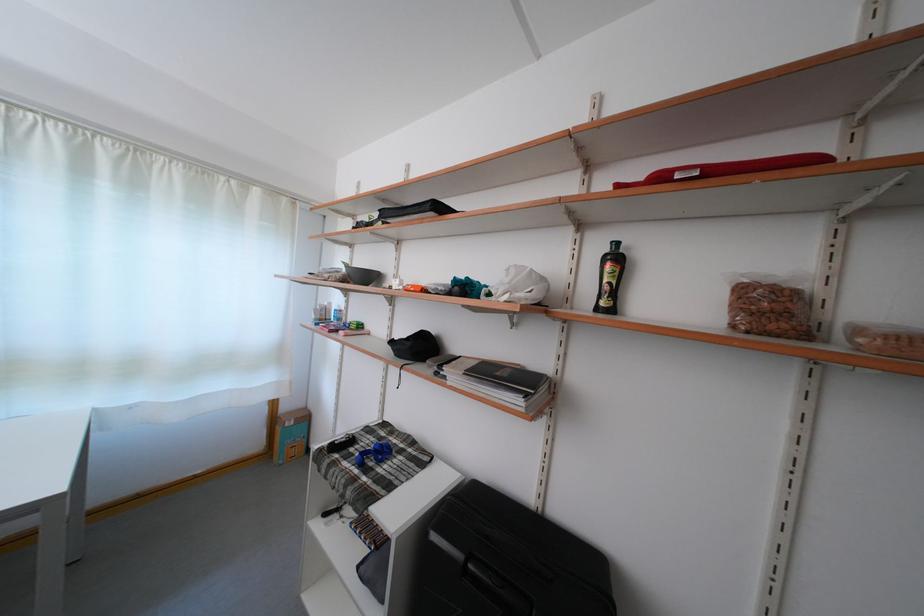
The location [341,444] corresponds to which object?

It corresponds to the black remote control in the image.